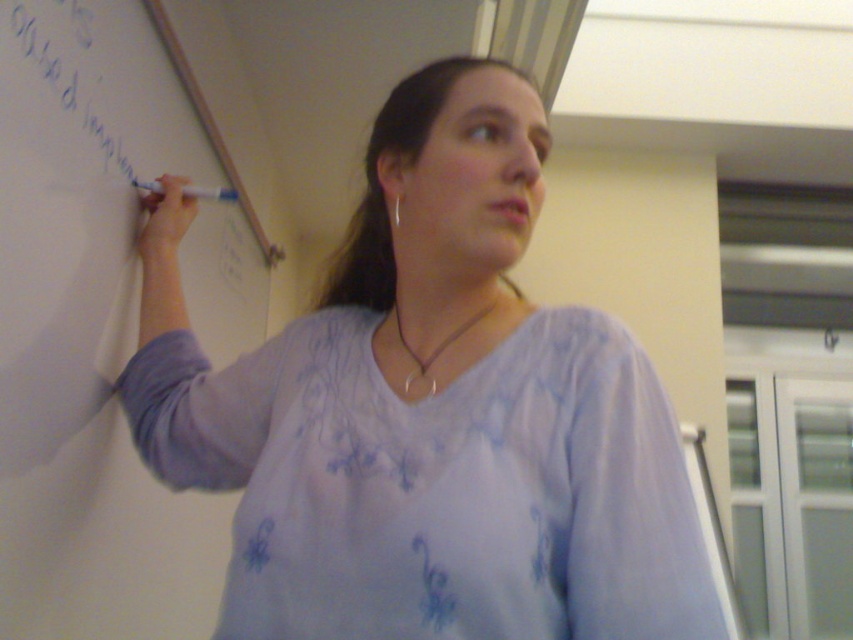
Between whiteboard at left and white marker at upper left, which one has more height?

whiteboard at left

Who is higher up, whiteboard at left or white marker at upper left?

white marker at upper left is higher up.

Is point (64, 145) less distant than point (97, 115)?

Yes, point (64, 145) is in front of point (97, 115).

You are a GUI agent. You are given a task and a screenshot of the screen. Output one action in this format:
    pyautogui.click(x=<x>, y=<y>)
    Task: Click on the whiteboard at left
    
    Given the screenshot: What is the action you would take?
    pyautogui.click(x=88, y=324)

Consider the image. Can you confirm if light purple fabric at upper left is bigger than white marker at upper left?

Indeed, light purple fabric at upper left has a larger size compared to white marker at upper left.

Measure the distance between light purple fabric at upper left and white marker at upper left.

17.43 inches

Who is more forward, (459,212) or (49,67)?

Point (459,212)

The height and width of the screenshot is (640, 853). Find the location of `light purple fabric at upper left`. light purple fabric at upper left is located at coordinates (428, 413).

Does light purple fabric at upper left appear under whiteboard at left?

Actually, light purple fabric at upper left is above whiteboard at left.

Does light purple fabric at upper left lie behind whiteboard at left?

That is False.

Which is in front, point (404, 410) or point (1, 412)?

Point (404, 410) is more forward.

Identify the location of light purple fabric at upper left. The height and width of the screenshot is (640, 853). (428, 413).